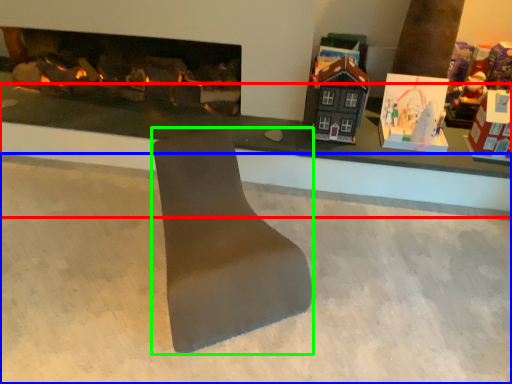
Question: Considering the real-world distances, which object is closest to table (highlighted by a red box)? concrete (highlighted by a blue box) or footrest (highlighted by a green box).

Choices:
 (A) concrete
 (B) footrest

Answer: (A)